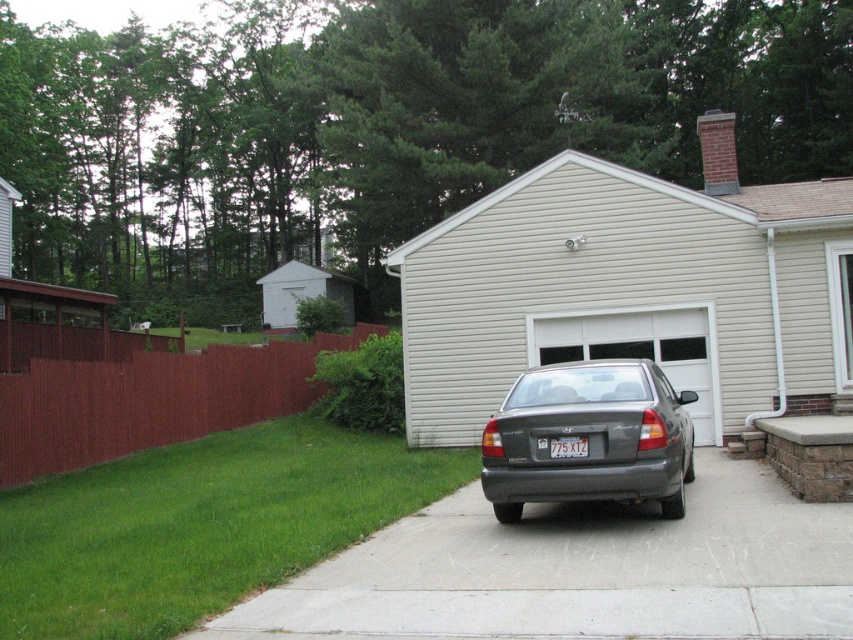
Question: Does gray concrete pavement at center appear on the left side of satin gray sedan at center?

Choices:
 (A) yes
 (B) no

Answer: (A)

Question: Which is nearer to the white siding garage at center?

Choices:
 (A) gray concrete pavement at center
 (B) brown wood fence at left

Answer: (B)

Question: Is white siding garage at center thinner than white wood shed at left?

Choices:
 (A) no
 (B) yes

Answer: (A)

Question: Which object is the farthest from the gray concrete pavement at center?

Choices:
 (A) satin gray sedan at center
 (B) white siding garage at center
 (C) white wood shed at left
 (D) white plastic license plate at center

Answer: (C)

Question: Which point is closer to the camera?

Choices:
 (A) gray concrete pavement at center
 (B) white plastic license plate at center
 (C) white siding garage at center

Answer: (A)

Question: From the image, what is the correct spatial relationship of satin gray sedan at center in relation to white plastic license plate at center?

Choices:
 (A) above
 (B) below

Answer: (B)